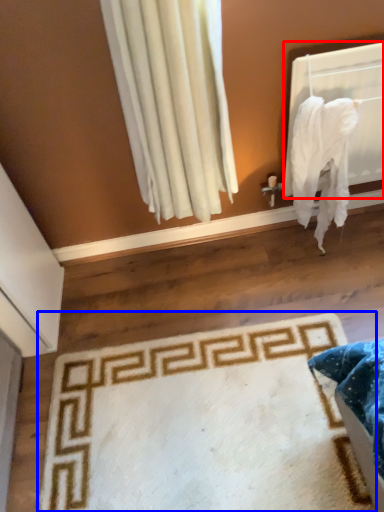
Question: Among these objects, which one is farthest to the camera, window screen (highlighted by a red box) or mat (highlighted by a blue box)?

Choices:
 (A) window screen
 (B) mat

Answer: (A)